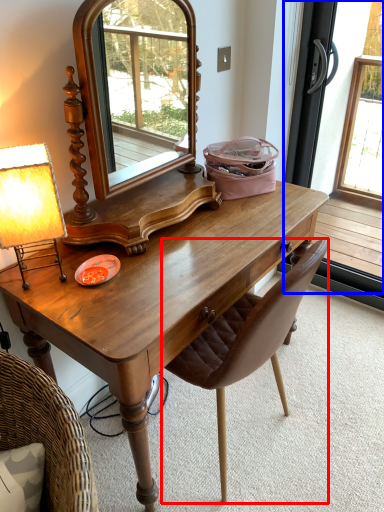
Question: Which of the following is the farthest to the observer, chair (highlighted by a red box) or screen door (highlighted by a blue box)?

Choices:
 (A) chair
 (B) screen door

Answer: (B)